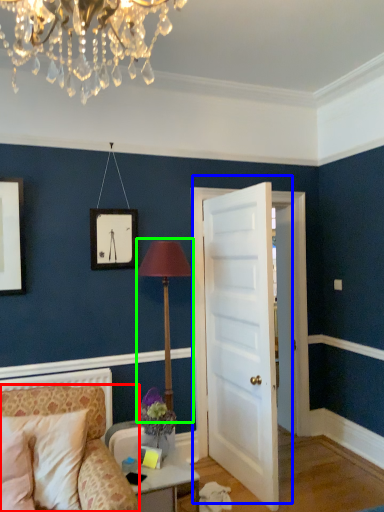
Question: Which object is positioned farthest from chair (highlighted by a red box)? Select from door (highlighted by a blue box) and table lamp (highlighted by a green box).

Choices:
 (A) door
 (B) table lamp

Answer: (A)